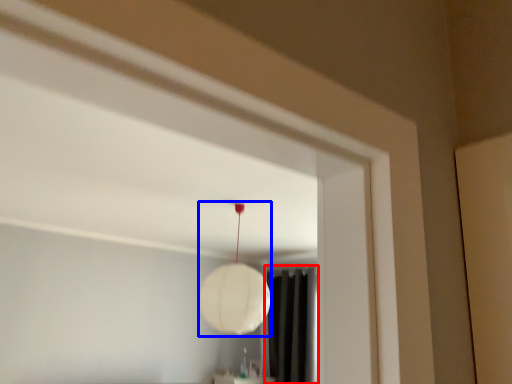
Question: Which object is further to the camera taking this photo, curtain (highlighted by a red box) or lamp (highlighted by a blue box)?

Choices:
 (A) curtain
 (B) lamp

Answer: (A)